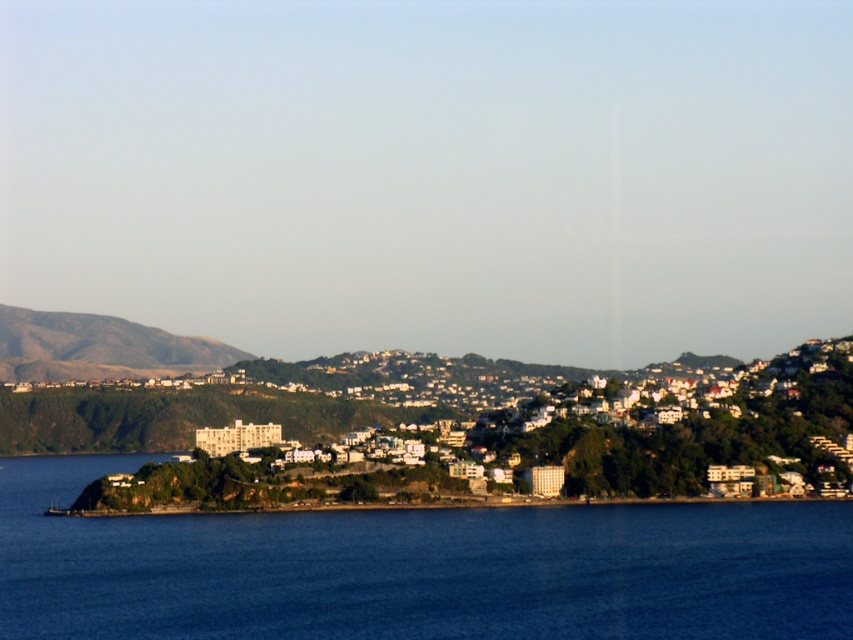
Question: Estimate the real-world distances between objects in this image. Which object is farther from the blue liquid water at lower left?

Choices:
 (A) white matte building at center
 (B) rustic brown hillside at left

Answer: (B)

Question: Does blue liquid water at lower left lie in front of white matte building at center?

Choices:
 (A) yes
 (B) no

Answer: (B)

Question: Among these objects, which one is nearest to the camera?

Choices:
 (A) white matte building at center
 (B) blue liquid water at lower left
 (C) rustic brown hillside at left

Answer: (A)

Question: Can you confirm if blue liquid water at lower left is positioned to the right of white matte building at center?

Choices:
 (A) yes
 (B) no

Answer: (B)

Question: Which point appears closest to the camera in this image?

Choices:
 (A) (718, 394)
 (B) (177, 560)
 (C) (84, 368)

Answer: (B)

Question: Does blue liquid water at lower left have a larger size compared to rustic brown hillside at left?

Choices:
 (A) no
 (B) yes

Answer: (B)